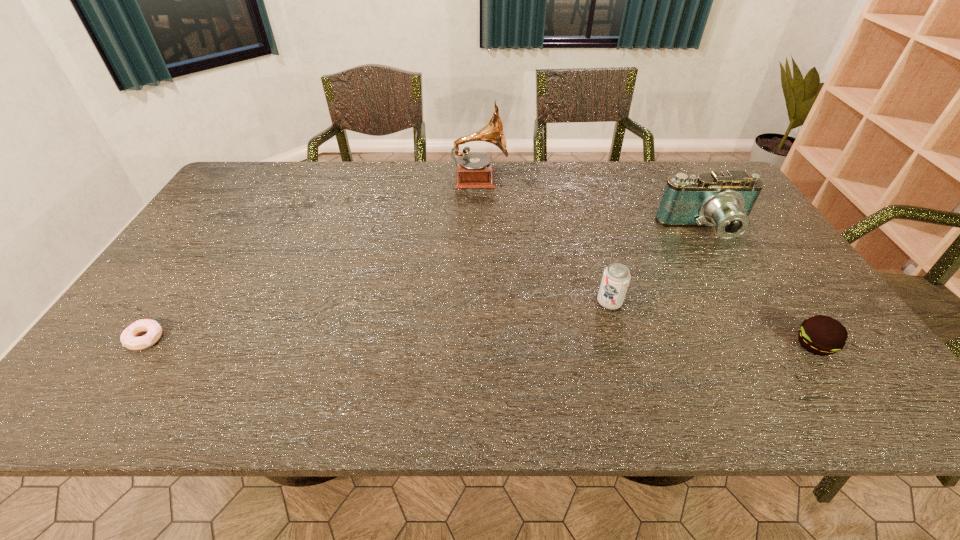
Find the location of a particular element. The height and width of the screenshot is (540, 960). the tallest object is located at coordinates (474, 170).

This screenshot has height=540, width=960. I want to click on phonograph_record, so (x=474, y=170).

Find the location of a particular element. The height and width of the screenshot is (540, 960). the second tallest object is located at coordinates (724, 200).

This screenshot has width=960, height=540. What are the coordinates of `camcorder` in the screenshot? It's located at (724, 200).

Locate an element on the screen. The image size is (960, 540). the third object from left to right is located at coordinates (615, 281).

Where is `the third nearest object`? The image size is (960, 540). the third nearest object is located at coordinates click(x=615, y=281).

Find the location of a particular element. The width and height of the screenshot is (960, 540). patty is located at coordinates (821, 335).

Identify the location of doughnut. pos(128,338).

This screenshot has height=540, width=960. What are the coordinates of `the leftmost object` in the screenshot? It's located at (128, 338).

Locate an element on the screen. The height and width of the screenshot is (540, 960). free space located 0.100m on the horn of the tallest object is located at coordinates [x=537, y=179].